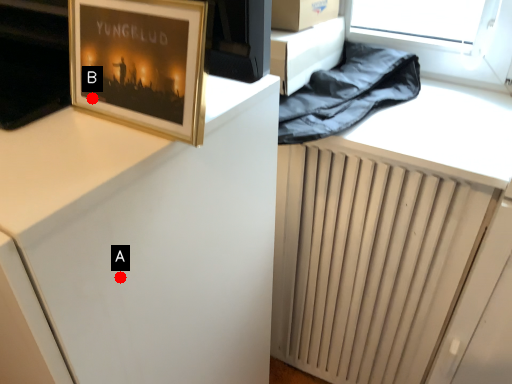
Question: Two points are circled on the image, labeled by A and B beside each circle. Which point is farther from the camera taking this photo?

Choices:
 (A) A is further
 (B) B is further

Answer: (B)